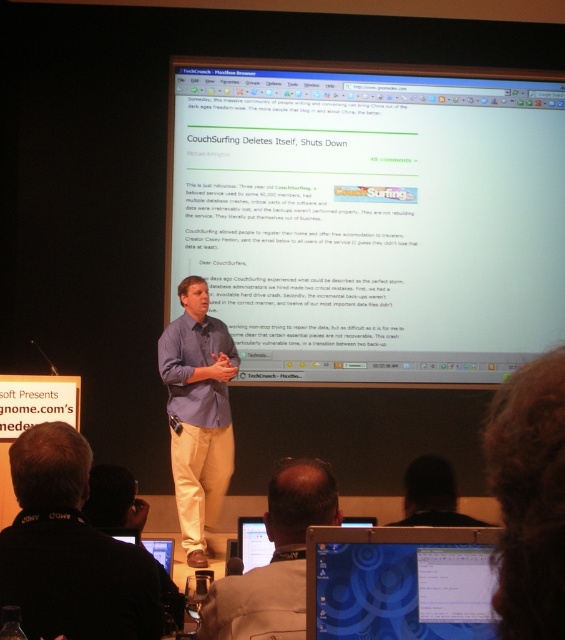
You are an attendee at the presentation. You notice two points marked in the image. One is at coordinates point (289, 100) and the other at point (375, 625). Which point is closer to the speaker?

Point (289, 100) is behind point (375, 625), so the point closer to the speaker is point (375, 625).

You are an event organizer who needs to ensure that all attendees can clearly see the presentation. Given the white glossy projection screen at upper center and the blue glossy laptop at lower center, which one is bigger and would be more suitable for the audience to view the main presentation content?

The white glossy projection screen at upper center has a larger size compared to the blue glossy laptop at lower center, making it more suitable for the audience to view the main presentation content.